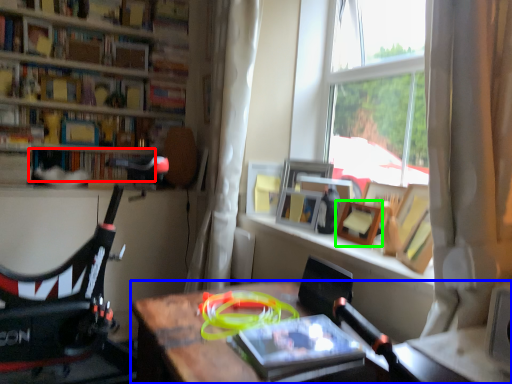
Question: Which object is positioned closest to book (highlighted by a red box)? Select from desk (highlighted by a blue box) and picture frame (highlighted by a green box).

Choices:
 (A) desk
 (B) picture frame

Answer: (A)